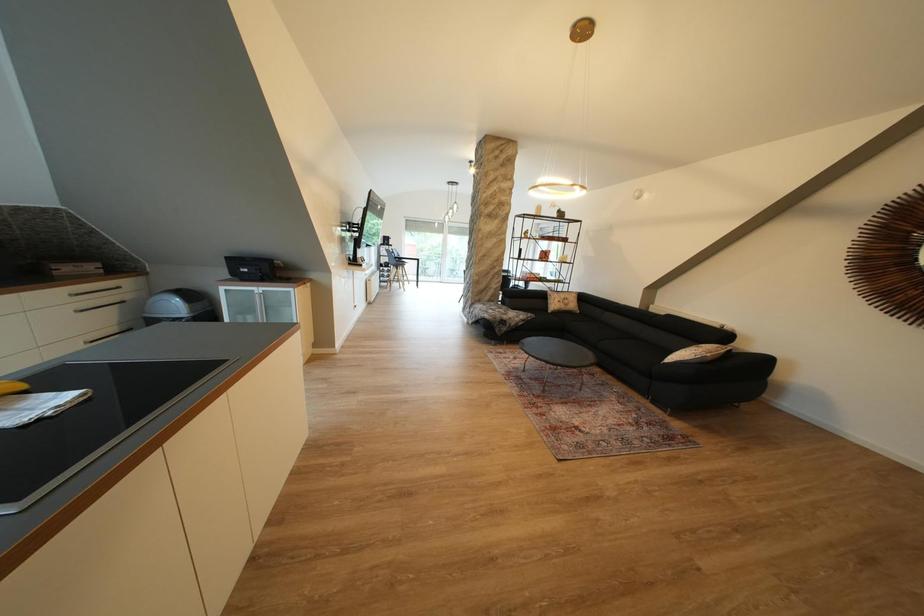
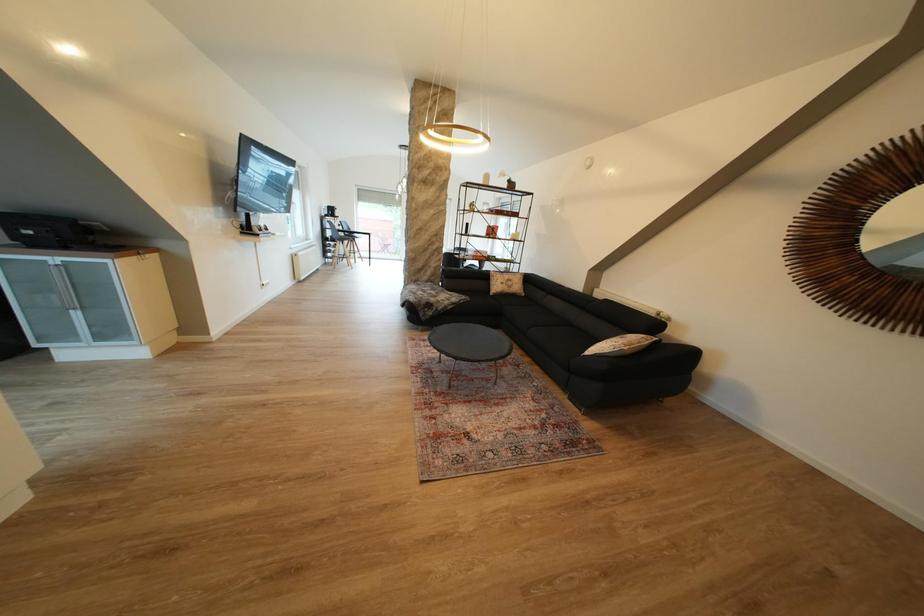
Which direction would the cameraman need to move to produce the second image?

The cameraman moved toward right, forward.